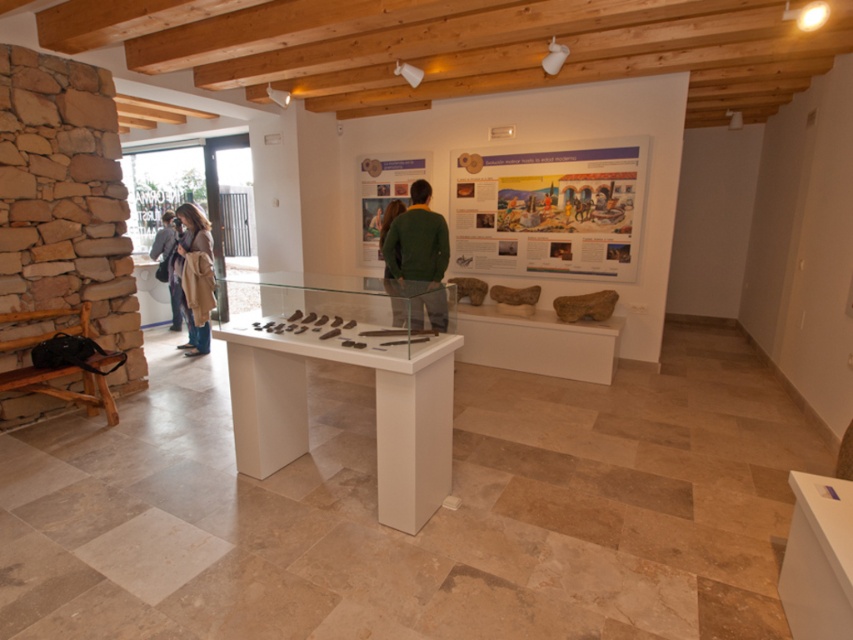
You are a museum visitor who wants to place a rectangular box that is 1.2 meters wide on the display table. The table has the green matte sweater at center and the brown leather jacket at center. Which object should you move to make space for the box?

You should move the brown leather jacket at center because its width is greater than the green matte sweater at center, so removing it would free up more space for the 1.2 meter wide box.

You are a visitor in the museum and you see two items displayed on the white display table at center. Which one is taller between the brown woolen coat at center and the brown leather jacket at center?

The brown woolen coat at center is much taller than the brown leather jacket at center.

You are standing at the entrance of the exhibition space and see two points marked in the scene. The first point is at coordinates point (440,227) and the second is at point (190,272). Which point is closer to you?

Point (440,227) is in front of point (190,272), so it is closer to you.